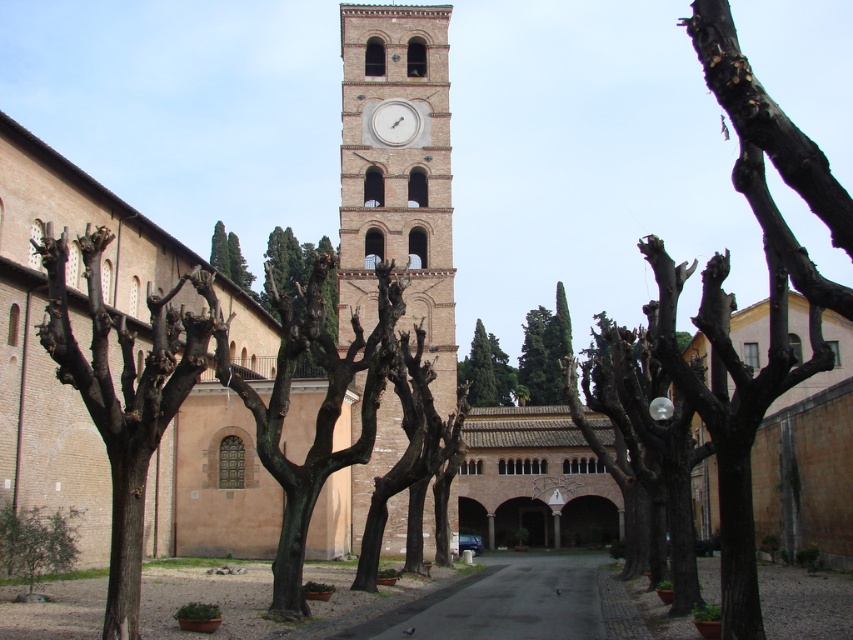
Can you confirm if bare wood tree at left is positioned to the left of green leafy tree at center?

Indeed, bare wood tree at left is positioned on the left side of green leafy tree at center.

Which is in front, point (141, 396) or point (544, 362)?

Point (141, 396)

The height and width of the screenshot is (640, 853). Describe the element at coordinates (123, 397) in the screenshot. I see `bare wood tree at left` at that location.

Where is `bare wood tree at left`? The width and height of the screenshot is (853, 640). bare wood tree at left is located at coordinates (123, 397).

Is point (397, 154) positioned before point (399, 115)?

Yes, it is in front of point (399, 115).

The width and height of the screenshot is (853, 640). I want to click on brick clock tower at center, so 397,177.

What are the coordinates of `brick clock tower at center` in the screenshot? It's located at (397, 177).

Is green leafy tree at center smaller than green leafy tree at lower left?

No, green leafy tree at center is not smaller than green leafy tree at lower left.

Does green leafy tree at center appear on the right side of green leafy tree at lower left?

Indeed, green leafy tree at center is positioned on the right side of green leafy tree at lower left.

What do you see at coordinates (520, 360) in the screenshot? This screenshot has height=640, width=853. I see `green leafy tree at center` at bounding box center [520, 360].

Find the location of `green leafy tree at center`. green leafy tree at center is located at coordinates (520, 360).